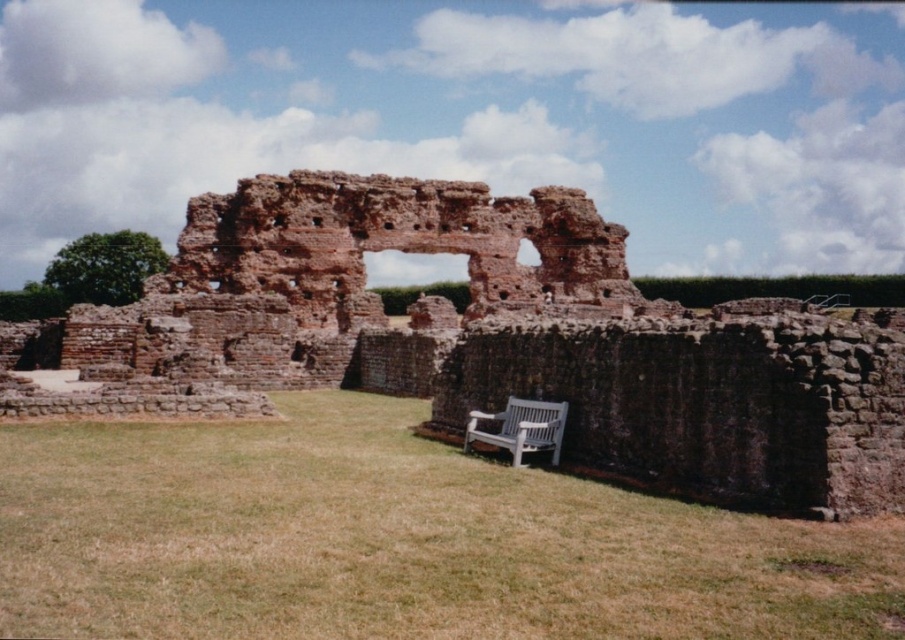
Question: From the image, what is the correct spatial relationship of brown stone ruins at center in relation to white wooden bench at lower center?

Choices:
 (A) below
 (B) above

Answer: (B)

Question: Does brown stone ruins at center have a greater width compared to white wooden bench at lower center?

Choices:
 (A) no
 (B) yes

Answer: (B)

Question: Where is brown stone ruins at center located in relation to white wooden bench at lower center in the image?

Choices:
 (A) right
 (B) left

Answer: (B)

Question: Among these objects, which one is farthest from the camera?

Choices:
 (A) brown stone ruins at center
 (B) white wooden bench at lower center

Answer: (B)

Question: Which point is farther from the camera taking this photo?

Choices:
 (A) 789,394
 (B) 549,436

Answer: (B)